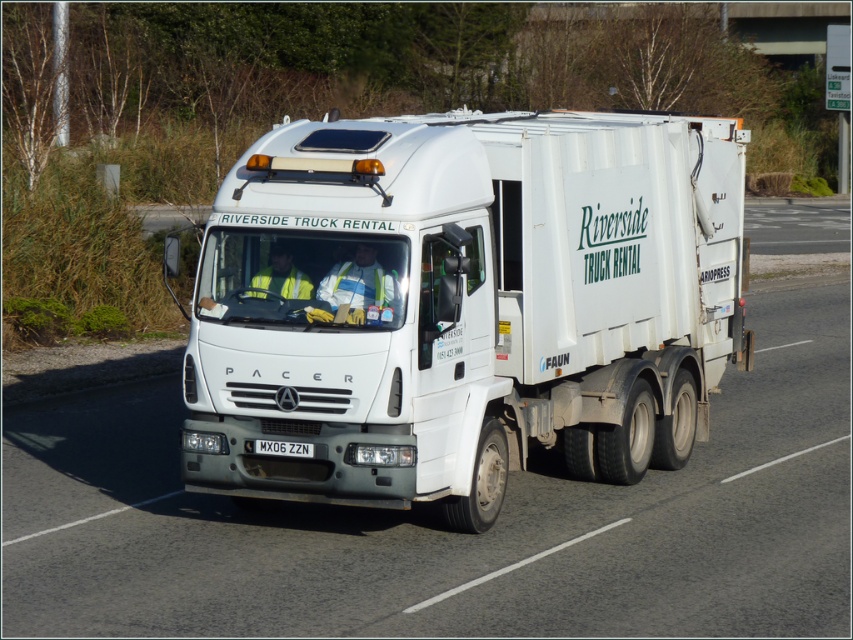
You are a delivery driver who needs to park your vehicle behind the white matte trailer truck at center. The parking lot has a minimum distance requirement of 30 feet between vehicles for safety. Based on the scene, can you safely park your vehicle behind the truck without violating the parking rules?

The white matte trailer truck at center is 29.49 feet away from the camera. Since the parking lot requires a minimum distance of 30 feet between vehicles, parking behind it would not meet the safety requirement as the current distance is less than 30 feet.

Consider the image. You are a delivery person who needs to attach a GPS tracker to the white metallic license plate at center. The GPS tracker has a range of 5 feet. Can you attach it to the white matte trailer truck at center without exceeding the GPS tracker range?

The white matte trailer truck at center and white metallic license plate at center are 4.93 feet apart. Since the GPS tracker has a range of 5 feet, attaching it to the license plate while on the truck would be within range.

You are a traffic officer observing a white matte trailer truck at center and a white metallic license plate at center on a road. Which object is closer to the left side of the road?

The white metallic license plate at center is closer to the left side of the road because the white matte trailer truck at center is positioned to its right.